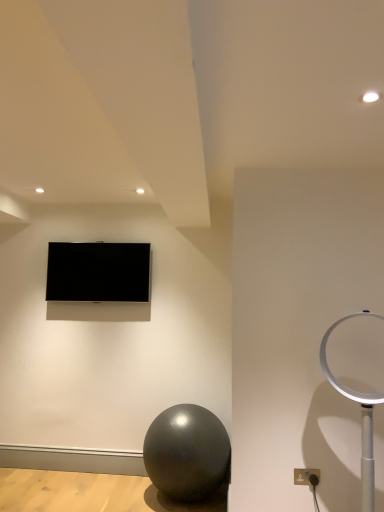
Find the location of a particular element. The width and height of the screenshot is (384, 512). free space that is to the left of shiny metallic ball at lower center is located at coordinates (117, 494).